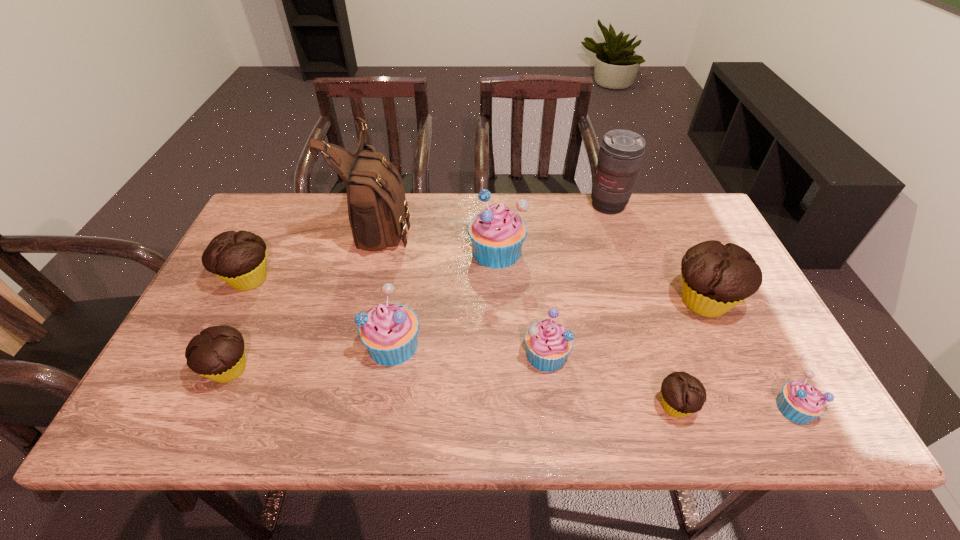
At what (x,y) coordinates should I click in order to perform the action: click on shoulder bag. Please return your answer as a coordinate pair (x, y). Looking at the image, I should click on (377, 208).

In order to click on the tallest object in this screenshot , I will do `click(377, 208)`.

What are the coordinates of `the ninth shortest object` in the screenshot? It's located at (621, 152).

Identify the location of the biggest blue muffin. This screenshot has width=960, height=540. (497, 234).

Where is `the biggest chocolate muffin`? The height and width of the screenshot is (540, 960). the biggest chocolate muffin is located at coordinates (715, 278).

Locate an element on the screen. the leftmost blue muffin is located at coordinates (389, 331).

You are a GUI agent. You are given a task and a screenshot of the screen. Output one action in this format:
    pyautogui.click(x=<x>, y=<y>)
    Task: Click on the sixth muffin from right to left
    
    Given the screenshot: What is the action you would take?
    pyautogui.click(x=389, y=331)

At what (x,y) coordinates should I click in order to perform the action: click on the third smallest chocolate muffin. Please return your answer as a coordinate pair (x, y). The height and width of the screenshot is (540, 960). Looking at the image, I should click on (239, 258).

Where is `the second smallest blue muffin`? the second smallest blue muffin is located at coordinates (548, 343).

Where is `the third biggest chocolate muffin`? the third biggest chocolate muffin is located at coordinates (218, 352).